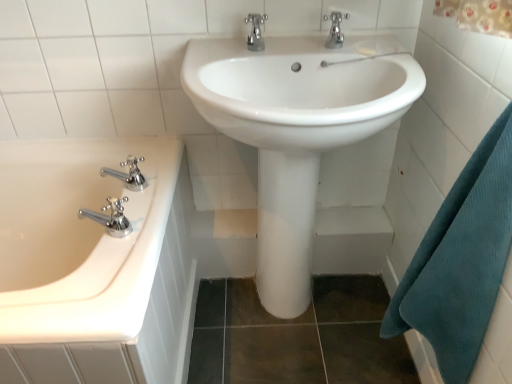
Identify the location of spots to the right of chrome metallic faucet at upper center, the first tap in the top-to-bottom sequence. (370, 49).